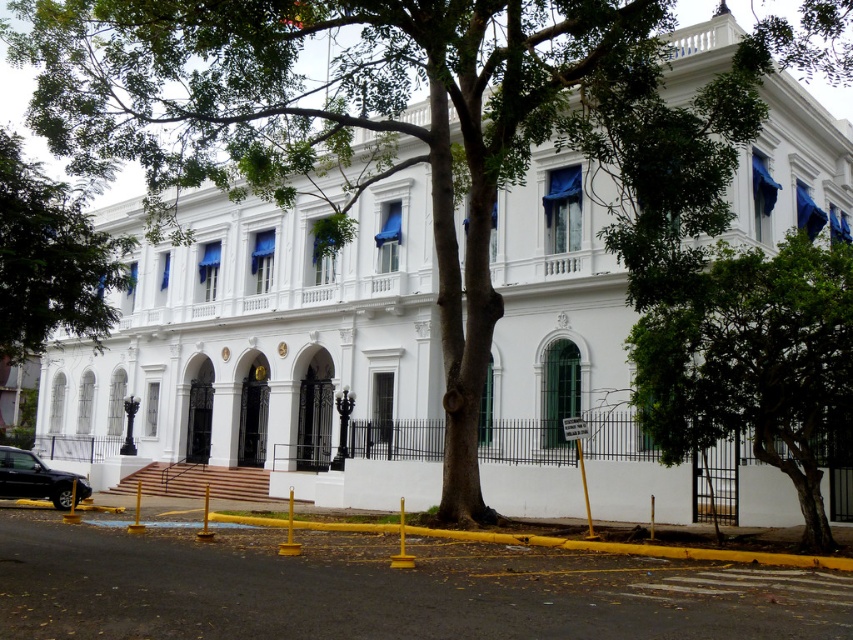
Does point (90, 225) lie behind point (44, 481)?

No, (90, 225) is closer to viewer.

Who is positioned more to the left, green leafy tree at left or shiny black sedan at lower left?

From the viewer's perspective, green leafy tree at left appears more on the left side.

Locate an element on the screen. green leafy tree at left is located at coordinates (49, 260).

Find the location of a particular element. The image size is (853, 640). green leafy tree at left is located at coordinates click(x=49, y=260).

Which is in front, point (743, 289) or point (16, 474)?

Point (743, 289) is in front.

Is the position of green leafy tree at center more distant than that of shiny black sedan at lower left?

No, green leafy tree at center is closer to the viewer.

Locate an element on the screen. Image resolution: width=853 pixels, height=640 pixels. green leafy tree at center is located at coordinates (750, 358).

Which is in front, point (822, 253) or point (42, 260)?

Point (42, 260) is in front.

Consider the image. Does green leafy tree at center have a lesser width compared to green leafy tree at left?

Indeed, green leafy tree at center has a lesser width compared to green leafy tree at left.

Is point (727, 262) positioned after point (91, 259)?

That is False.

You are a GUI agent. You are given a task and a screenshot of the screen. Output one action in this format:
    pyautogui.click(x=<x>, y=<y>)
    Task: Click on the green leafy tree at center
    This screenshot has height=640, width=853.
    Given the screenshot: What is the action you would take?
    pyautogui.click(x=750, y=358)